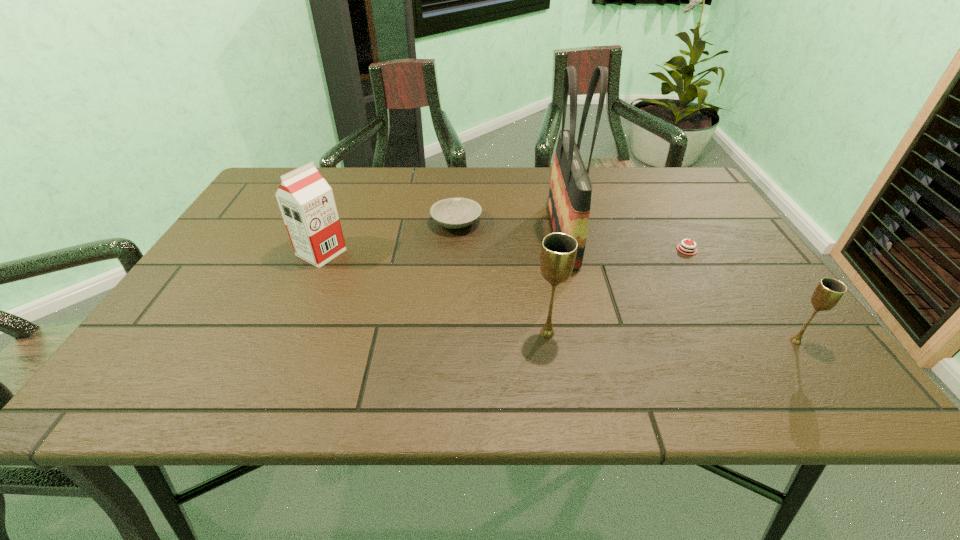
Image resolution: width=960 pixels, height=540 pixels. I want to click on the taller chalice, so click(558, 252).

The image size is (960, 540). What are the coordinates of `the fourth object from right to left` in the screenshot? It's located at (558, 252).

Locate an element on the screen. This screenshot has width=960, height=540. the fourth tallest object is located at coordinates (829, 291).

Find the location of `the rightmost object`. the rightmost object is located at coordinates (829, 291).

You are a GUI agent. You are given a task and a screenshot of the screen. Output one action in this format:
    pyautogui.click(x=<x>, y=<y>)
    Task: Click on the tallest object
    The height and width of the screenshot is (540, 960).
    Given the screenshot: What is the action you would take?
    pyautogui.click(x=569, y=202)

You are a GUI agent. You are given a task and a screenshot of the screen. Output one action in this format:
    pyautogui.click(x=<x>, y=<y>)
    Task: Click on the fourth object from left to right
    The height and width of the screenshot is (540, 960).
    Given the screenshot: What is the action you would take?
    coord(569,202)

Locate an element on the screen. the leftmost object is located at coordinates (306, 201).

You are a GUI agent. You are given a task and a screenshot of the screen. Output one action in this format:
    pyautogui.click(x=<x>, y=<y>)
    Task: Click on the second object from right to left
    
    Given the screenshot: What is the action you would take?
    pyautogui.click(x=686, y=249)

At what (x,y) coordinates should I click in order to perform the action: click on chocolate cake. Please return your answer as a coordinate pair (x, y). The height and width of the screenshot is (540, 960). Looking at the image, I should click on (686, 249).

The height and width of the screenshot is (540, 960). I want to click on the second shortest object, so click(453, 213).